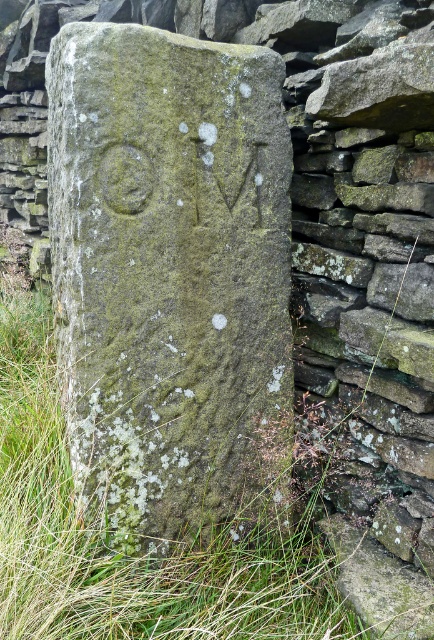
You are standing at the base of the dry stone wall and see two points marked on the stone marker. The first point is at coordinates point (114,58) and the second point is at point (296,605). Which point is closer to you?

Point (114,58) is in front of point (296,605), so it is closer to you.

You are standing at the point marked by the coordinates (170, 275) in the image. What object are you currently positioned on?

You are positioned on the green mossy stone at center, as the coordinates (170, 275) correspond to this object according to the provided description.